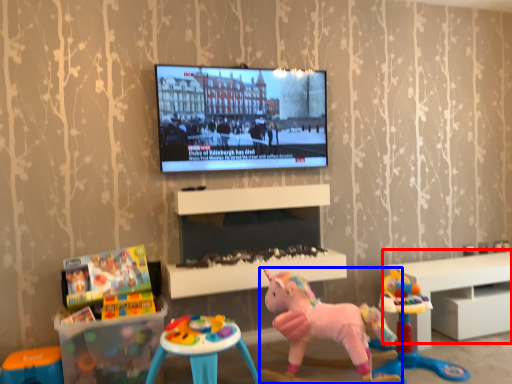
Question: Which of the following is the farthest to the observer, furniture (highlighted by a red box) or toy (highlighted by a blue box)?

Choices:
 (A) furniture
 (B) toy

Answer: (A)